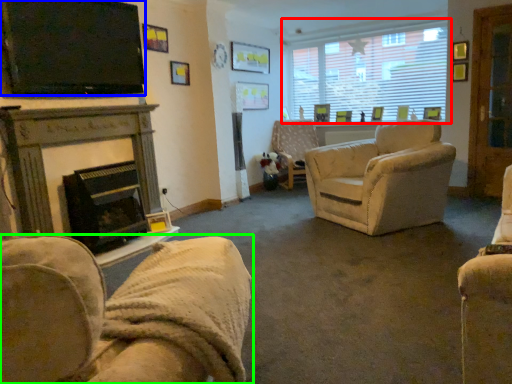
Question: Which is farther away from window (highlighted by a red box)? television (highlighted by a blue box) or chair (highlighted by a green box)?

Choices:
 (A) television
 (B) chair

Answer: (B)